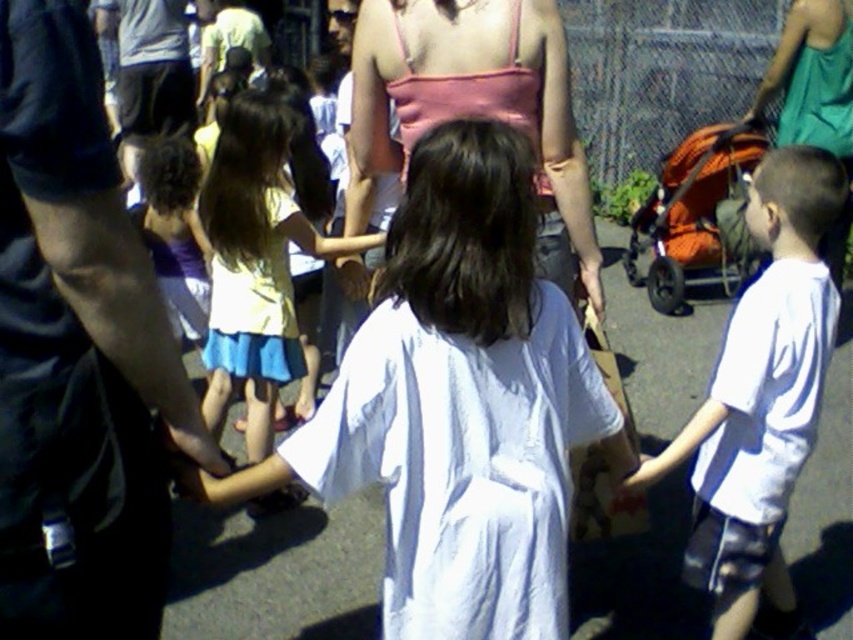
You are organizing a clothing donation drive and need to determine which dress is more suitable for a child who requires larger clothing sizes. Based on the image provided, which dress between the pink fabric dress at center and the yellow fabric dress at center should you choose?

The pink fabric dress at center has a larger size compared to the yellow fabric dress at center, so it is more suitable for a child requiring larger clothing sizes.

You are a photographer trying to capture a photo of the two dresses in the scene. The pink fabric dress at center and the yellow fabric dress at center are both in the frame. Based on their heights, which dress will appear taller in the photo?

The pink fabric dress at center will appear taller in the photo since it has a greater height compared to the yellow fabric dress at center.

You are a photographer at the event and want to capture a photo that includes both the pink fabric dress at center and the orange fabric stroller at right. Based on their positions, which object should be placed on the left side of the photo frame?

The pink fabric dress at center should be placed on the left side of the photo frame because it is positioned to the left of the orange fabric stroller at right.